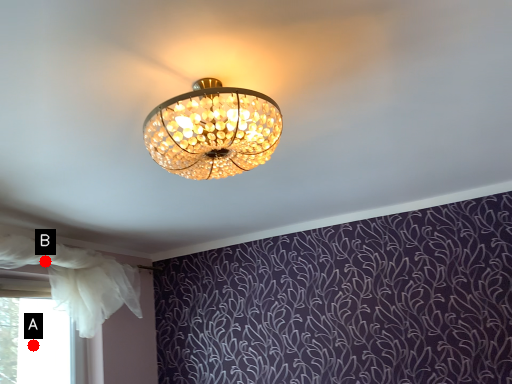
Question: Two points are circled on the image, labeled by A and B beside each circle. Which point is farther from the camera taking this photo?

Choices:
 (A) A is further
 (B) B is further

Answer: (A)